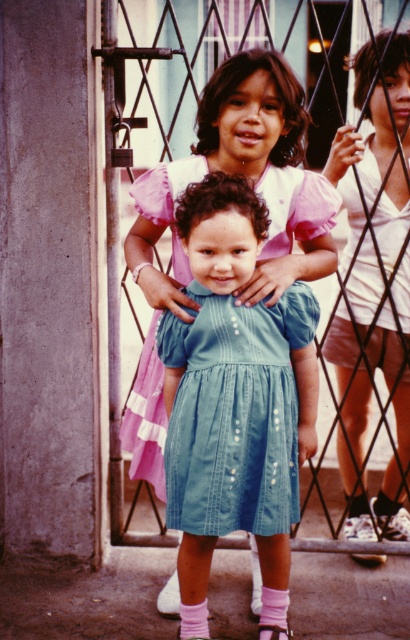
Question: Which object appears farthest from the camera in this image?

Choices:
 (A) white satin blouse at upper right
 (B) denim dress at center

Answer: (A)

Question: Which of the following is the farthest from the observer?

Choices:
 (A) (396, 474)
 (B) (266, 634)

Answer: (A)

Question: Among these objects, which one is farthest from the camera?

Choices:
 (A) denim dress at center
 (B) white satin blouse at upper right

Answer: (B)

Question: Does denim dress at center appear on the left side of white satin blouse at upper right?

Choices:
 (A) no
 (B) yes

Answer: (B)

Question: Where is denim dress at center located in relation to white satin blouse at upper right in the image?

Choices:
 (A) above
 (B) below

Answer: (B)

Question: Does denim dress at center appear on the left side of white satin blouse at upper right?

Choices:
 (A) no
 (B) yes

Answer: (B)